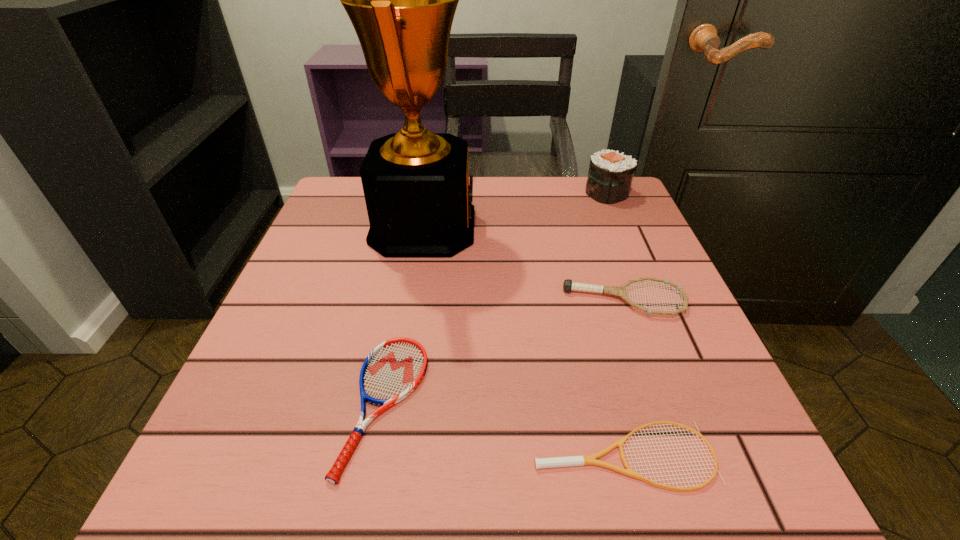
Locate an element on the screen. trophy cup is located at coordinates (401, 0).

Image resolution: width=960 pixels, height=540 pixels. Find the location of `the second tallest object`. the second tallest object is located at coordinates (610, 175).

Locate an element on the screen. This screenshot has height=540, width=960. the third farthest object is located at coordinates (568, 286).

The width and height of the screenshot is (960, 540). In order to click on the farthest tennis racket in this screenshot , I will do click(568, 286).

Identify the location of the leftmost tennis racket. (393, 370).

Find the location of a particular element. The width and height of the screenshot is (960, 540). vacant area situated 0.200m on the front of the trophy cup with the label is located at coordinates (564, 227).

Where is `vacant space located 0.240m on the left of the sushi`? Image resolution: width=960 pixels, height=540 pixels. vacant space located 0.240m on the left of the sushi is located at coordinates (488, 193).

Locate an element on the screen. The height and width of the screenshot is (540, 960). vacant space situated 0.340m on the back of the third shortest object is located at coordinates (586, 192).

This screenshot has width=960, height=540. Identify the location of free point located 0.340m on the right of the leftmost tennis racket. (658, 404).

Find the location of `trophy cup located at the far edge`. trophy cup located at the far edge is located at coordinates (401, 0).